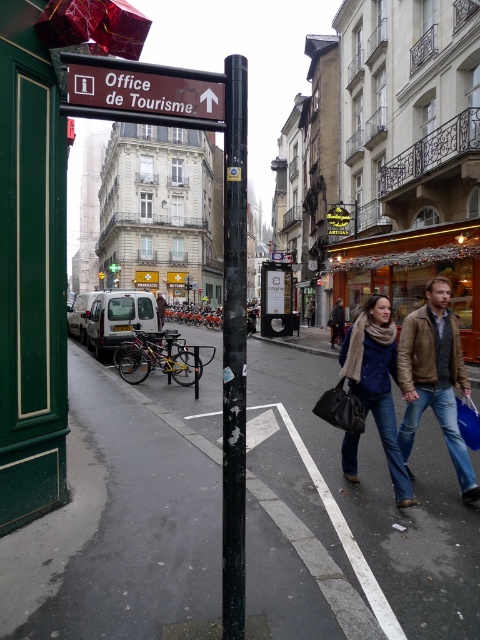
Can you confirm if black asphalt pavement at lower center is taller than brown wooden sign at upper center?

Incorrect, black asphalt pavement at lower center's height is not larger of brown wooden sign at upper center's.

Who is higher up, black asphalt pavement at lower center or brown wooden sign at upper center?

brown wooden sign at upper center

At what (x,y) coordinates should I click in order to perform the action: click on black asphalt pavement at lower center. Please return your answer as a coordinate pair (x, y). Looking at the image, I should click on (348, 522).

Identify the location of black asphalt pavement at lower center. (348, 522).

Can you confirm if black asphalt pavement at lower center is taller than blue denim jeans at lower right?

No.

Is black asphalt pavement at lower center bigger than blue denim jeans at lower right?

Correct, black asphalt pavement at lower center is larger in size than blue denim jeans at lower right.

The width and height of the screenshot is (480, 640). Identify the location of black asphalt pavement at lower center. (348, 522).

Image resolution: width=480 pixels, height=640 pixels. Describe the element at coordinates (233, 348) in the screenshot. I see `black matte pole at center` at that location.

Is point (223, 500) less distant than point (422, 349)?

Yes, point (223, 500) is closer to viewer.

Is point (240, 426) positioned behind point (417, 422)?

No, it is in front of (417, 422).

At what (x,y) coordinates should I click in order to perform the action: click on black matte pole at center. Please return your answer as a coordinate pair (x, y). This screenshot has width=480, height=640. Looking at the image, I should click on (233, 348).